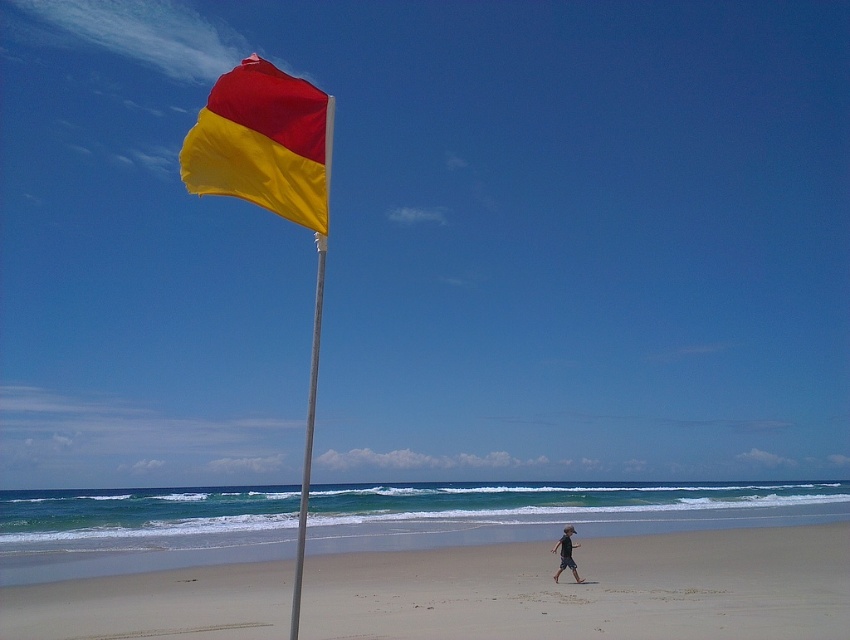
Can you confirm if silver metallic flag pole at left is positioned below tan skin person at center?

Actually, silver metallic flag pole at left is above tan skin person at center.

Is silver metallic flag pole at left thinner than tan skin person at center?

Incorrect, silver metallic flag pole at left's width is not less than tan skin person at center's.

Does point (298, 586) come farther from viewer compared to point (554, 579)?

No.

Where is `silver metallic flag pole at left`? Image resolution: width=850 pixels, height=640 pixels. silver metallic flag pole at left is located at coordinates (309, 433).

Does matte fabric flag at upper left have a greater width compared to silver metallic flag pole at left?

Incorrect, matte fabric flag at upper left's width does not surpass silver metallic flag pole at left's.

Between point (252, 134) and point (304, 456), which one is positioned behind?

The point (304, 456) is behind.

Does point (309, 144) come closer to viewer compared to point (309, 429)?

Yes.

Locate an element on the screen. matte fabric flag at upper left is located at coordinates (264, 144).

From the picture: Can you confirm if matte fabric flag at upper left is wider than tan skin person at center?

Indeed, matte fabric flag at upper left has a greater width compared to tan skin person at center.

From the picture: Does matte fabric flag at upper left appear on the left side of tan skin person at center?

Correct, you'll find matte fabric flag at upper left to the left of tan skin person at center.

Which is in front, point (242, 163) or point (567, 557)?

Point (242, 163) is in front.

This screenshot has height=640, width=850. I want to click on matte fabric flag at upper left, so click(x=264, y=144).